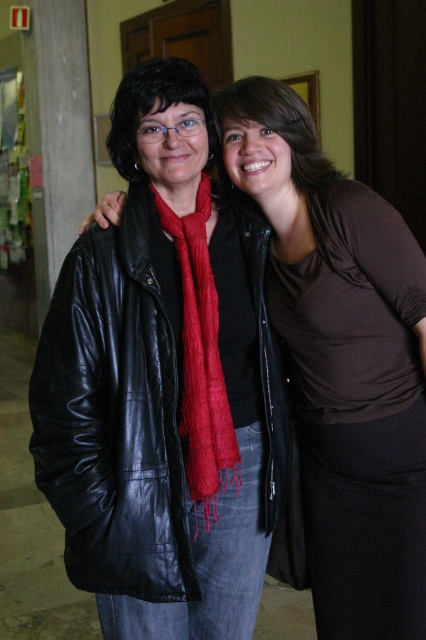
Can you confirm if red knitted scarf at center is positioned to the left of matte black scarf at upper left?

Incorrect, red knitted scarf at center is not on the left side of matte black scarf at upper left.

Is red knitted scarf at center to the right of matte black scarf at upper left from the viewer's perspective?

Yes, red knitted scarf at center is to the right of matte black scarf at upper left.

Is point (192, 266) behind point (161, 61)?

That is True.

This screenshot has width=426, height=640. What are the coordinates of `red knitted scarf at center` in the screenshot? It's located at (201, 358).

Does point (382, 262) lie in front of point (178, 97)?

No, (382, 262) is further to viewer.

Where is `matte black leather jacket at left`? This screenshot has height=640, width=426. matte black leather jacket at left is located at coordinates (342, 362).

Is matte black leather jacket at left above black leather jacket at left?

Indeed, matte black leather jacket at left is positioned over black leather jacket at left.

Can you confirm if matte black leather jacket at left is positioned below black leather jacket at left?

Incorrect, matte black leather jacket at left is not positioned below black leather jacket at left.

Find the location of a particular element. The width and height of the screenshot is (426, 640). matte black leather jacket at left is located at coordinates (342, 362).